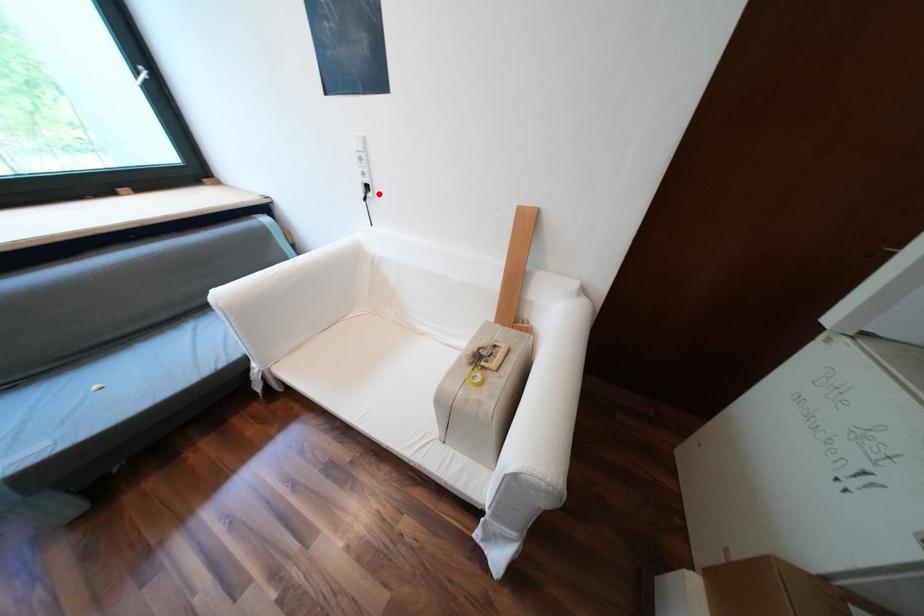
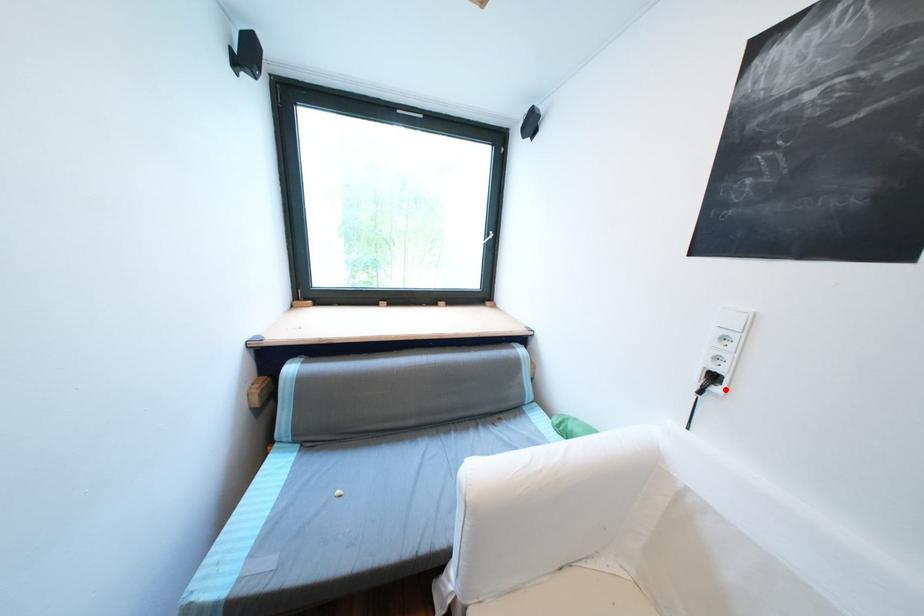
I am providing you with two images of the same scene from different viewpoints. A red point is marked on the first image and another point is marked on the second image. Does the point marked in image1 correspond to the same location as the one in image2?

Yes